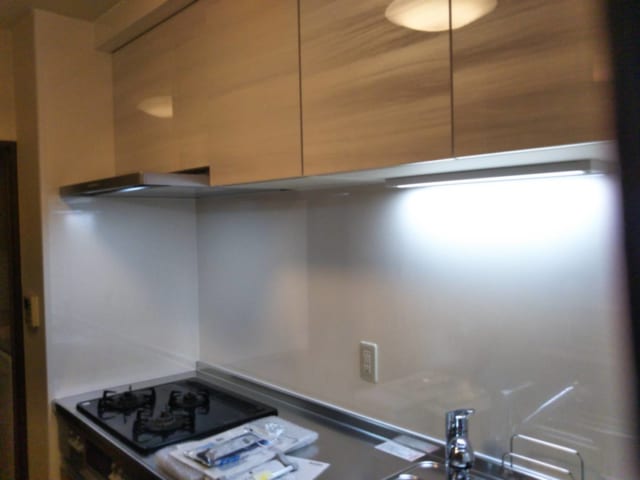
This screenshot has height=480, width=640. Identify the location of outlet. (369, 365).